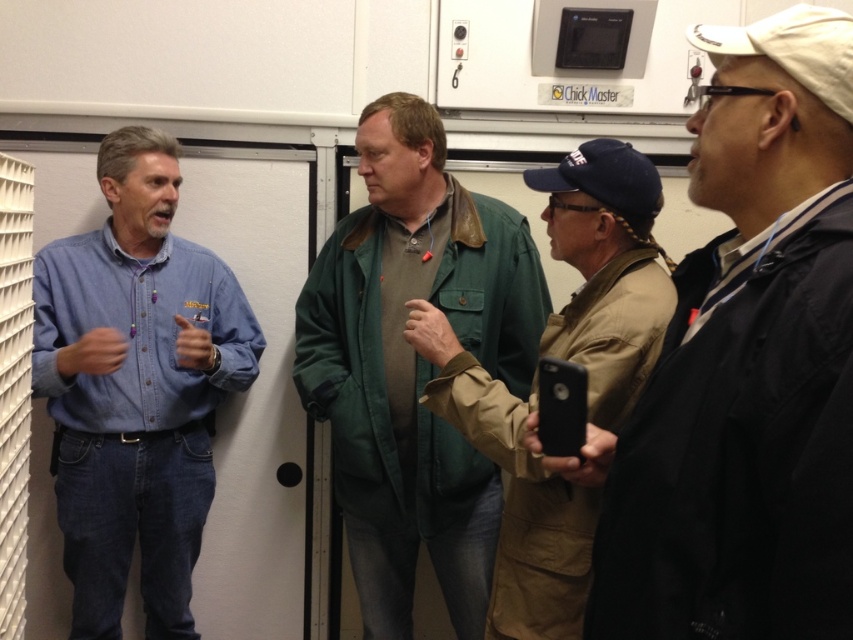
You are standing in the workshop and want to hand a tool to the person wearing the black matte jacket at right without disturbing the others. Since you can only move forward in a straight line, will you pass in front of the denim shirt at left on your way?

The black matte jacket at right is closer to the viewer than the denim shirt at left, so you will pass in front of the denim shirt at left on your way to the black matte jacket at right.

From the picture: You are an interior designer planning to place two jackets on a shelf. The black matte jacket at right and the green leather jacket at center must be placed side by side. Given their widths, which jacket should be placed first to ensure they both fit on the shelf?

The black matte jacket at right has a smaller width than the green leather jacket at center, so place the black matte jacket at right first to accommodate both on the shelf.

You are a photographer positioned in front of the group. You want to take a photo that includes both the denim shirt at left and the tan fabric jacket at center. Based on their positions, which object should be placed closer to the camera to ensure both are fully visible in the frame?

The denim shirt at left should be placed closer to the camera since the tan fabric jacket at center is behind it, ensuring both are visible without one blocking the other.